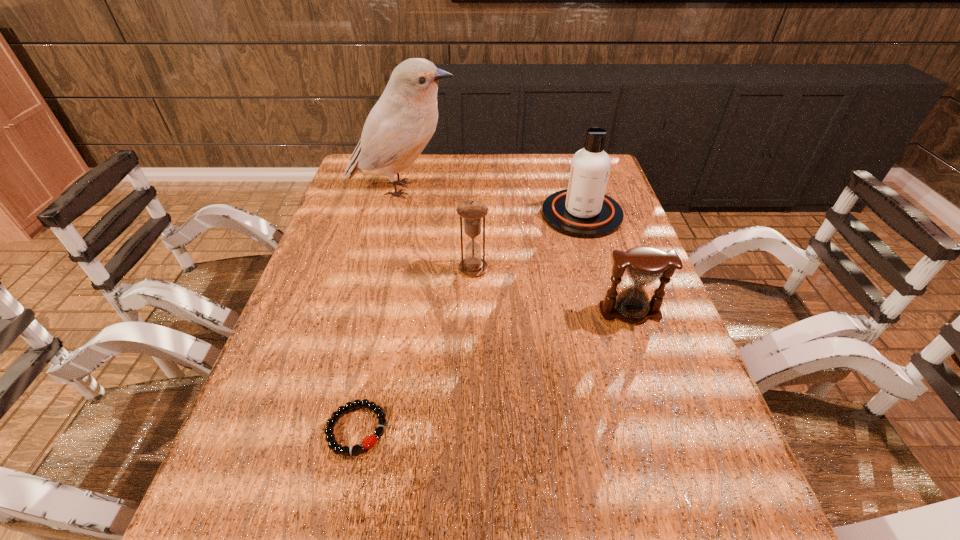
Locate an element on the screen. This screenshot has width=960, height=540. vacant space located on the front of the farther hourglass is located at coordinates (472, 346).

Locate an element on the screen. This screenshot has width=960, height=540. free spot located 0.240m on the front of the right hourglass is located at coordinates (666, 421).

This screenshot has width=960, height=540. Find the location of `free space located 0.370m on the back of the nearest object`. free space located 0.370m on the back of the nearest object is located at coordinates (391, 275).

Find the location of a particular element. object at the far edge is located at coordinates (402, 122).

At what (x,y) coordinates should I click in order to perform the action: click on parakeet that is positioned at the left edge. Please return your answer as a coordinate pair (x, y). Looking at the image, I should click on (402, 122).

Where is `bracelet at the left edge`? This screenshot has width=960, height=540. bracelet at the left edge is located at coordinates (367, 443).

Where is `cleansing agent located at the right edge`? The width and height of the screenshot is (960, 540). cleansing agent located at the right edge is located at coordinates (583, 210).

Where is `hourglass located in the right edge section of the desktop`? hourglass located in the right edge section of the desktop is located at coordinates (644, 265).

What are the coordinates of `object that is at the far left corner` in the screenshot? It's located at (402, 122).

This screenshot has height=540, width=960. I want to click on vacant space at the far edge of the desktop, so click(x=543, y=188).